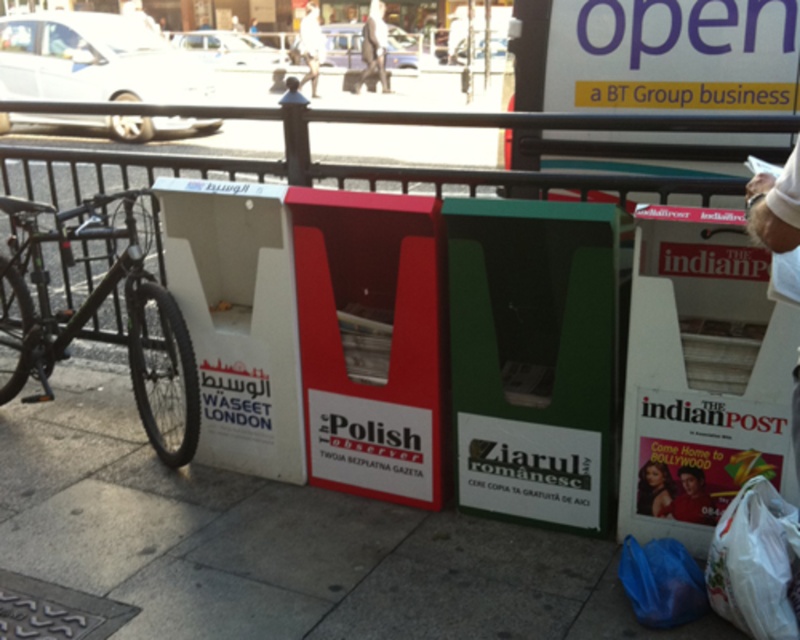
Looking at this image, does white cardboard sign at center have a lesser width compared to light gray shirt at center?

In fact, white cardboard sign at center might be wider than light gray shirt at center.

Where is `white cardboard sign at center`? The height and width of the screenshot is (640, 800). white cardboard sign at center is located at coordinates (276, 541).

Describe the element at coordinates (276, 541) in the screenshot. Image resolution: width=800 pixels, height=640 pixels. I see `white cardboard sign at center` at that location.

Identify the location of white cardboard sign at center. (276, 541).

Can you confirm if blue plastic bag at lower center is bigger than light gray shirt at center?

Actually, blue plastic bag at lower center might be smaller than light gray shirt at center.

Is point (628, 576) closer to viewer compared to point (380, 84)?

Yes.

Find the location of a particular element. The height and width of the screenshot is (640, 800). blue plastic bag at lower center is located at coordinates (x=662, y=582).

Does white plastic bag at lower right lie in front of blue plastic bag at lower center?

Yes, white plastic bag at lower right is in front of blue plastic bag at lower center.

You are a GUI agent. You are given a task and a screenshot of the screen. Output one action in this format:
    pyautogui.click(x=<x>, y=<y>)
    Task: Click on the white plastic bag at lower right
    The height and width of the screenshot is (640, 800).
    Given the screenshot: What is the action you would take?
    pyautogui.click(x=754, y=561)